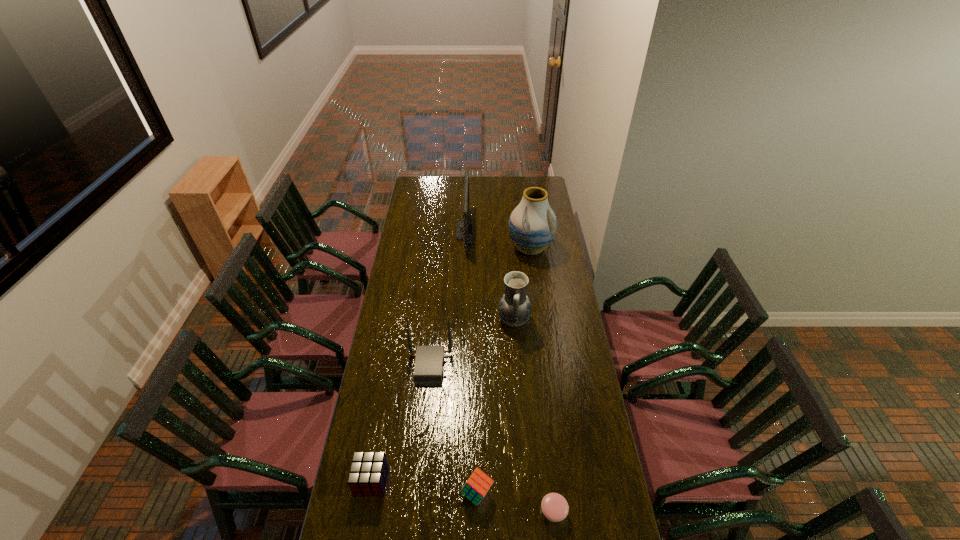
Where is `free space between the fourth shortest object and the monitor`? free space between the fourth shortest object and the monitor is located at coordinates (447, 299).

In order to click on empty space that is in between the fourth nearest object and the cupcake in this screenshot , I will do `click(492, 440)`.

Select which object is the fourth closest to the monitor. Please provide its 2D coordinates. Your answer should be formatted as a tuple, i.e. [(x, y)], where the tuple contains the x and y coordinates of a point satisfying the conditions above.

[(368, 473)]

Select which object is the fifth closest to the right cube. Please provide its 2D coordinates. Your answer should be formatted as a tuple, i.e. [(x, y)], where the tuple contains the x and y coordinates of a point satisfying the conditions above.

[(532, 225)]

Find the location of a particular element. This screenshot has width=960, height=540. free spot that satisfies the following two spatial constraints: 1. on the front side of the cupcake; 2. on the left side of the leftmost object is located at coordinates (366, 512).

I want to click on vacant point that satisfies the following two spatial constraints: 1. on the screen side of the monitor; 2. on the left side of the shortest object, so click(452, 512).

Locate an element on the screen. The width and height of the screenshot is (960, 540). vacant space that satisfies the following two spatial constraints: 1. on the back side of the leftmost object; 2. on the right side of the tallest object is located at coordinates (413, 248).